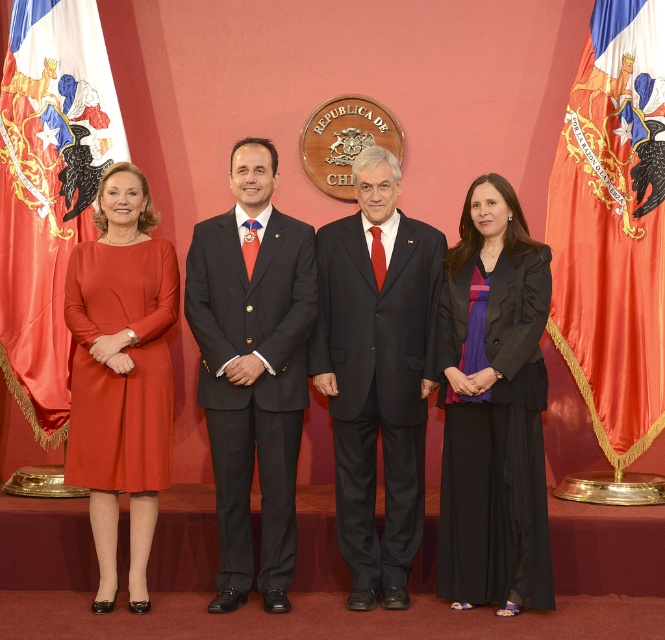
You are a photographer at an official event and need to adjust the camera focus. The black satin suit at center and the matte black suit at center are both in your frame. Which one should you focus on first if you want to capture the taller individual?

The black satin suit at center is taller than the matte black suit at center, so you should focus on the black satin suit at center first to capture the taller individual.

You are a photographer at the event and need to adjust the camera frame to include both the matte black suit at center and the matte orange dress at left. Given their widths, which object requires a wider angle to fully capture?

The matte black suit at center requires a wider angle because its width surpasses that of the matte orange dress at left.

You are a photographer at an official event. You need to arrange two people for a photo. The people are wearing a matte black suit at center and a matte orange dress at left. According to the scene description, which person should stand to the right of the other to match the original image?

The matte black suit at center should be positioned to the right of the matte orange dress at left to match the original image, as the matte black suit at center is positioned on the right side of matte orange dress at left.